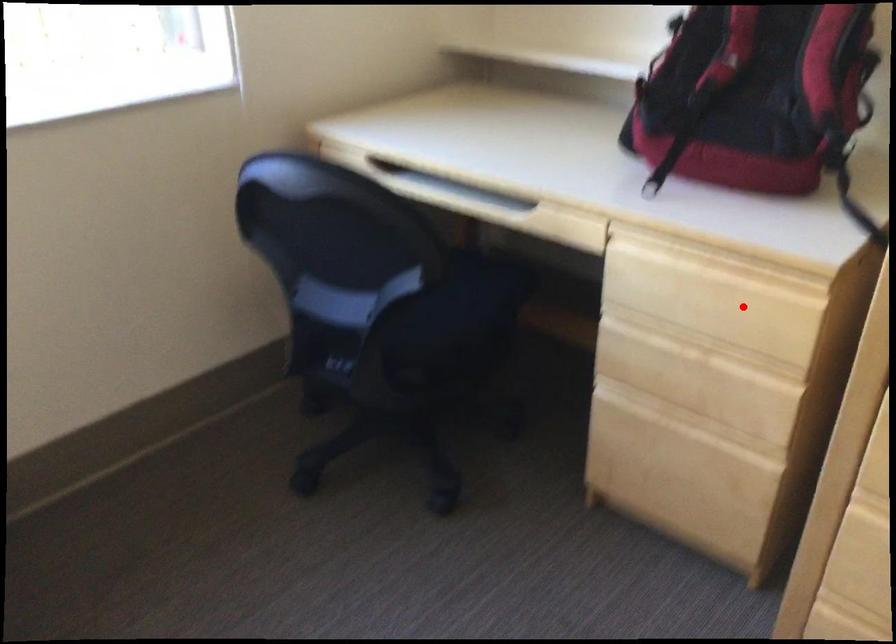
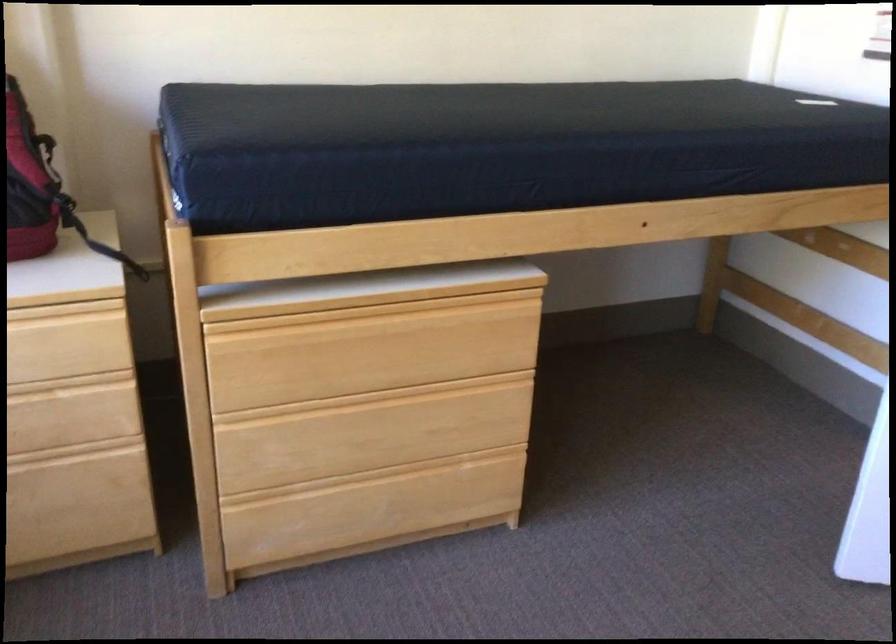
Locate, in the second image, the point that corresponds to the highlighted location in the first image.

(67, 348)